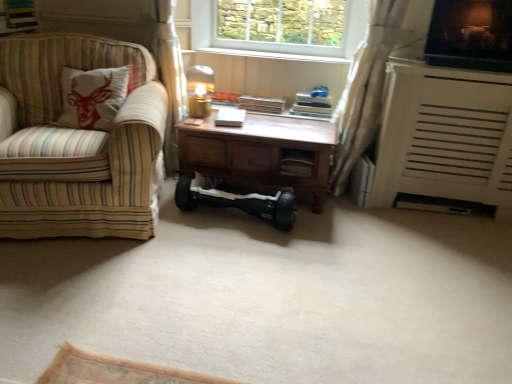
Identify the location of white textured heater at right. The image size is (512, 384). (443, 137).

In order to face white sheer curtain at right, should I rotate leftwards or rightwards?

To face it directly, rotate right by 15.182 degrees.

You are a GUI agent. You are given a task and a screenshot of the screen. Output one action in this format:
    pyautogui.click(x=<x>, y=<y>)
    Task: Click on the white wood at upper center
    
    Given the screenshot: What is the action you would take?
    pyautogui.click(x=273, y=55)

What do you see at coordinates (297, 162) in the screenshot? The image size is (512, 384). I see `wooden drawer at center` at bounding box center [297, 162].

Image resolution: width=512 pixels, height=384 pixels. Identify the location of black rubber hoverboard at center. (271, 297).

At what (x,y) coordinates should I click in order to perform the action: click on white textured heater at right. Please return your answer as a coordinate pair (x, y). This screenshot has width=512, height=384. Looking at the image, I should click on (443, 137).

Find the location of a particular element. The width and height of the screenshot is (512, 384). plain lying below the wooden drawer at center (from the image's perspective) is located at coordinates (271, 297).

Is wooden drawer at center located outside black rubber hoverboard at center?

Absolutely, wooden drawer at center is external to black rubber hoverboard at center.

Are wooden drawer at center and black rubber hoverboard at center far apart?

No, wooden drawer at center is not far away from black rubber hoverboard at center.

Can you tell me how much wooden drawer at center and black rubber hoverboard at center differ in facing direction?

86.5 degrees.

Is white textured heater at right oriented towards wooden desk at center?

No, white textured heater at right is not aimed at wooden desk at center.

Looking at this image, from the image's perspective, is white textured heater at right positioned above or below wooden desk at center?

white textured heater at right is above wooden desk at center.

Looking at this image, considering the sizes of white textured heater at right and wooden desk at center in the image, is white textured heater at right taller or shorter than wooden desk at center?

white textured heater at right is taller than wooden desk at center.

Based on the photo, considering the relative sizes of white textured heater at right and wooden desk at center in the image provided, is white textured heater at right wider than wooden desk at center?

Indeed, white textured heater at right has a greater width compared to wooden desk at center.

Based on the photo, who is smaller, striped fabric couch at left or wooden drawer at center?

wooden drawer at center is smaller.

Considering the relative positions of striped fabric couch at left and wooden drawer at center in the image provided, is striped fabric couch at left to the left of wooden drawer at center from the viewer's perspective?

Yes, striped fabric couch at left is to the left of wooden drawer at center.

Could you tell me if striped fabric couch at left is facing wooden drawer at center?

No, striped fabric couch at left is not facing towards wooden drawer at center.

From the image's perspective, who appears lower, striped fabric couch at left or wooden drawer at center?

wooden drawer at center.

At what (x,y) coordinates should I click in order to perform the action: click on drawer that appears below the white wood at upper center (from a real-world perspective). Please return your answer as a coordinate pair (x, y). The image size is (512, 384). Looking at the image, I should click on (297, 162).

What's the angular difference between wooden drawer at center and white wood at upper center's facing directions?

The angle between the facing direction of wooden drawer at center and the facing direction of white wood at upper center is 2.64 degrees.

Which is more to the right, wooden drawer at center or white wood at upper center?

wooden drawer at center is more to the right.

From a real-world perspective, is wooden drawer at center physically located above or below white wood at upper center?

In terms of real-world spatial position, wooden drawer at center is below white wood at upper center.

Considering the positions of objects striped fabric couch at left and wooden desk at center in the image provided, who is more to the left, striped fabric couch at left or wooden desk at center?

striped fabric couch at left is more to the left.

What are the coordinates of `studio couch above the wooden desk at center (from the image's perspective)` in the screenshot? It's located at (77, 143).

Is point (46, 72) closer or farther from the camera than point (253, 138)?

Clearly, point (46, 72) is more distant from the camera than point (253, 138).

Is point (373, 80) closer or farther from the camera than point (206, 179)?

Point (373, 80) is closer to the camera than point (206, 179).

From the image's perspective, between white sheer curtain at right and black rubber hoverboard at center, who is located below?

black rubber hoverboard at center.

Is white sheer curtain at right turned away from black rubber hoverboard at center?

No.

From a real-world perspective, who is located higher, white sheer curtain at right or black rubber hoverboard at center?

From a 3D spatial view, white sheer curtain at right is above.

From a real-world perspective, does striped fabric couch at left sit lower than black rubber hoverboard at center?

Incorrect, from a real-world perspective, striped fabric couch at left is higher than black rubber hoverboard at center.

Who is more distant, striped fabric couch at left or black rubber hoverboard at center?

black rubber hoverboard at center.

Is striped fabric couch at left not within black rubber hoverboard at center?

Indeed, striped fabric couch at left is completely outside black rubber hoverboard at center.

Identify the location of drawer behind the black rubber hoverboard at center. pos(297,162).

This screenshot has height=384, width=512. In order to click on heater in front of the wooden desk at center in this screenshot , I will do `click(443, 137)`.

Looking at the image, which one is located further to black rubber hoverboard at center, black rubber hoverboard at center or wooden drawer at center?

wooden drawer at center is positioned further to the anchor black rubber hoverboard at center.

From the image, which object appears to be farther from wooden desk at center, black rubber hoverboard at center or striped fabric couch at left?

Based on the image, striped fabric couch at left appears to be further to wooden desk at center.

Considering their positions, is white wood at upper center positioned closer to white sheer curtain at right than metallic gold table lamp at center?

white wood at upper center.

When comparing their distances from striped fabric couch at left, does white textured heater at right or wooden drawer at center seem further?

white textured heater at right.

Which object lies further to the anchor point striped fabric couch at left, black rubber hoverboard at center or wooden desk at center?

wooden desk at center lies further to striped fabric couch at left than the other object.

Estimate the real-world distances between objects in this image. Which object is closer to black rubber hoverboard at center, white textured heater at right or white wood at upper center?

white textured heater at right is closer to black rubber hoverboard at center.

Looking at the image, which one is located closer to wooden drawer at center, metallic gold table lamp at center or black rubber hoverboard at center?

black rubber hoverboard at center lies closer to wooden drawer at center than the other object.

From the image, which object appears to be nearer to metallic gold table lamp at center, wooden drawer at center or black rubber hoverboard at center?

Among the two, black rubber hoverboard at center is located nearer to metallic gold table lamp at center.

Locate an element on the screen. curtain between white wood at upper center and wooden drawer at center vertically is located at coordinates (373, 79).

Identify the location of window sill located between striped fabric couch at left and wooden drawer at center in the left-right direction. This screenshot has width=512, height=384. (273, 55).

Locate an element on the screen. This screenshot has height=384, width=512. table lamp between striped fabric couch at left and white textured heater at right is located at coordinates (200, 90).

I want to click on curtain located between wooden drawer at center and white textured heater at right in the left-right direction, so click(373, 79).